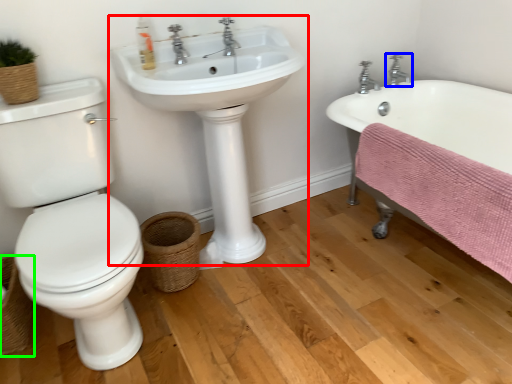
Question: Which is nearer to the sink (highlighted by a red box)? tap (highlighted by a blue box) or basket (highlighted by a green box).

Choices:
 (A) tap
 (B) basket

Answer: (B)